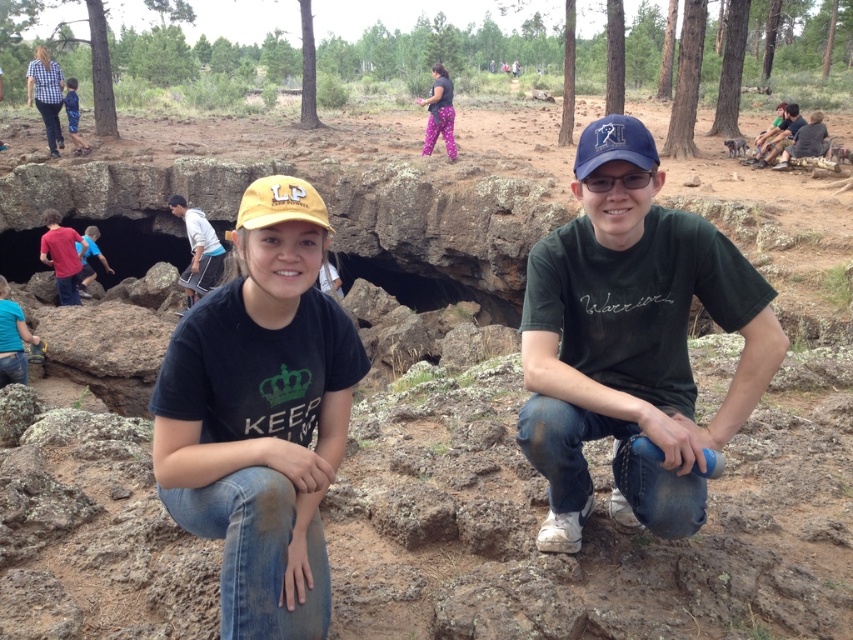
Where is the yellow fabric baseball cap at center located in the image?

The yellow fabric baseball cap at center is located at point [280,204].